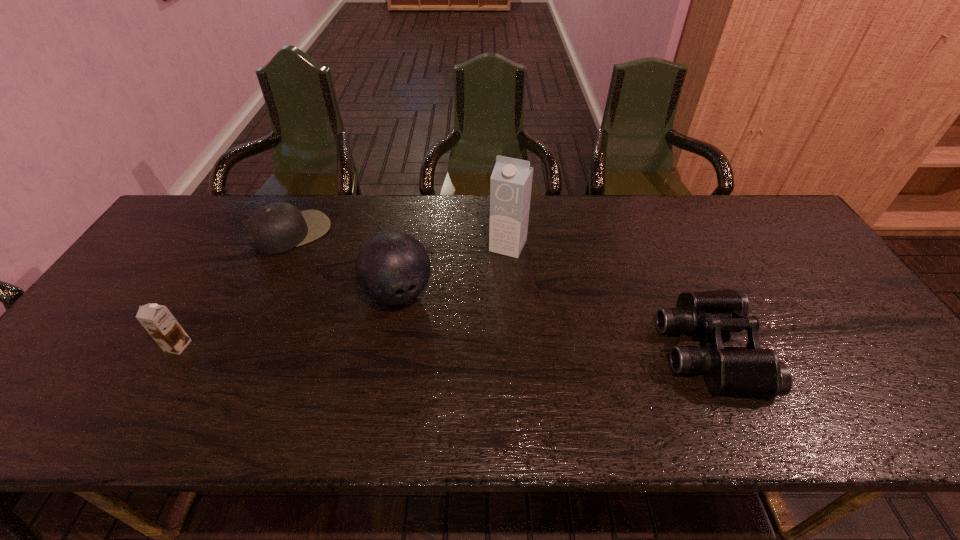
The width and height of the screenshot is (960, 540). I want to click on free spot between the fourth object from left to right and the bowling ball, so click(453, 269).

Locate an element on the screen. vacant space that is in between the tallest object and the second tallest object is located at coordinates click(453, 269).

Identify the location of free space between the carton and the fourth shortest object. (453, 269).

Identify the location of vacant space that's between the fourth shortest object and the third shortest object. The height and width of the screenshot is (540, 960). (288, 320).

Locate an element on the screen. free point between the carton and the third object from left to right is located at coordinates (453, 269).

This screenshot has height=540, width=960. I want to click on vacant point located between the rightmost object and the fourth shortest object, so click(553, 321).

The height and width of the screenshot is (540, 960). What are the coordinates of `object that is the closest to the fourth object from right to left` in the screenshot? It's located at (392, 268).

Identify which object is located as the fourth nearest to the fourth object from left to right. Please provide its 2D coordinates. Your answer should be formatted as a tuple, i.e. [(x, y)], where the tuple contains the x and y coordinates of a point satisfying the conditions above.

[(158, 321)]

Locate an element on the screen. free space that satisfies the following two spatial constraints: 1. on the back side of the cap; 2. on the left side of the leftmost object is located at coordinates (246, 232).

The height and width of the screenshot is (540, 960). I want to click on free space in the image that satisfies the following two spatial constraints: 1. on the front side of the binoculars; 2. on the front-facing side of the leftmost object, so click(x=176, y=349).